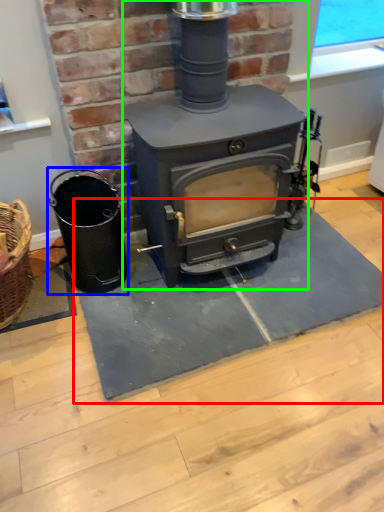
Question: Considering the real-world distances, which object is farthest from doormat (highlighted by a red box)? appliance (highlighted by a blue box) or wood burning stove (highlighted by a green box)?

Choices:
 (A) appliance
 (B) wood burning stove

Answer: (B)